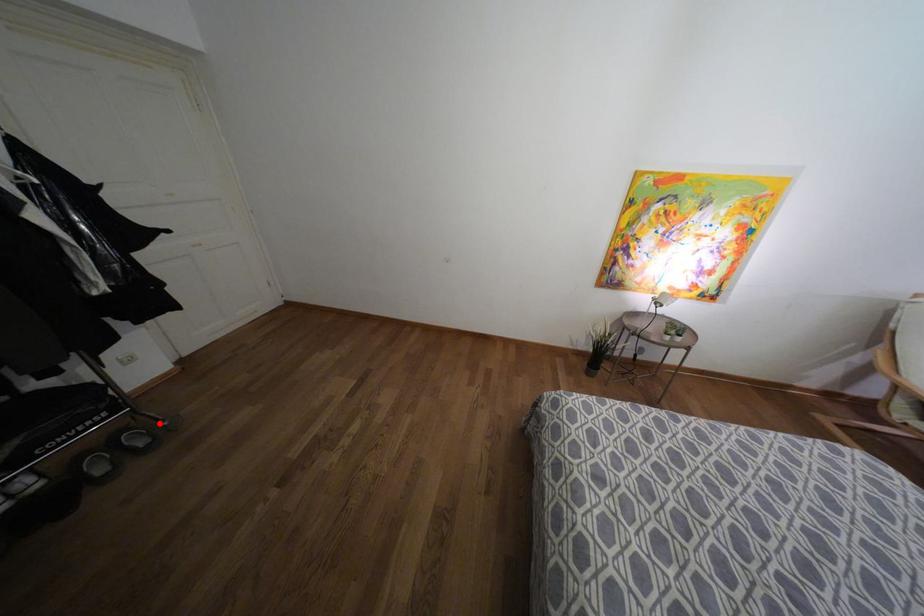
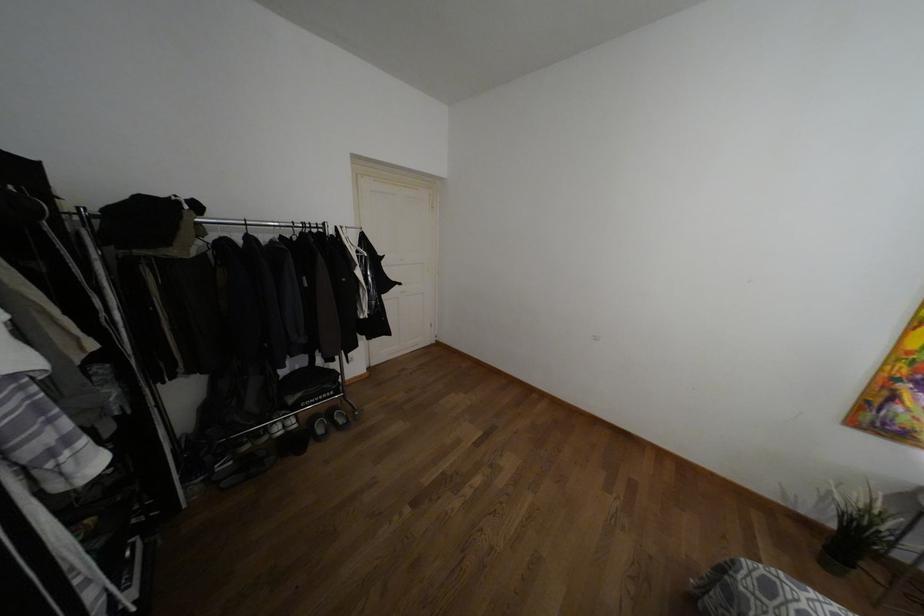
Locate, in the second image, the point that corresponds to the highlighted location in the first image.

(353, 411)